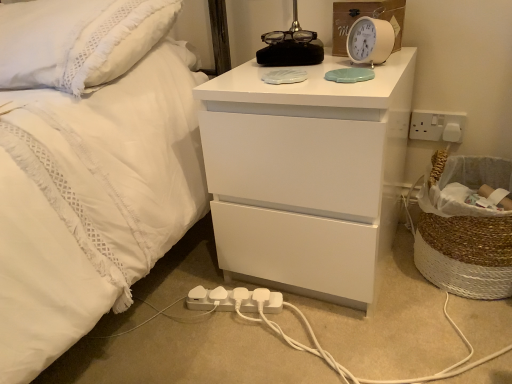
Where is `vacant region in front of white plastic extension cord at lower center`? Image resolution: width=512 pixels, height=384 pixels. vacant region in front of white plastic extension cord at lower center is located at coordinates (233, 352).